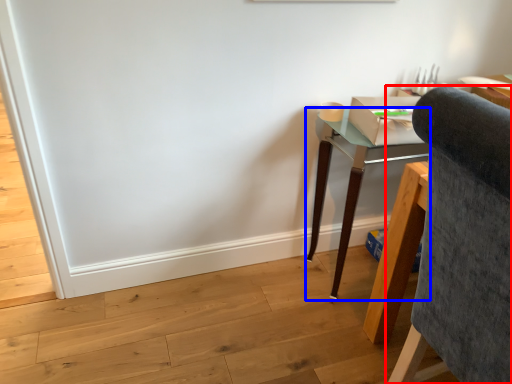
Question: Which object is closer to the camera taking this photo, chair (highlighted by a red box) or desk (highlighted by a blue box)?

Choices:
 (A) chair
 (B) desk

Answer: (A)